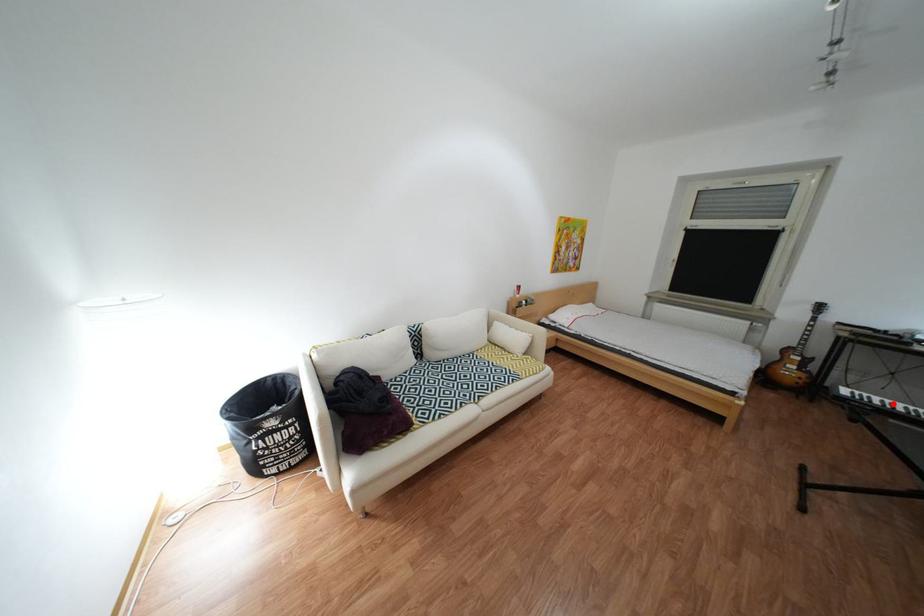
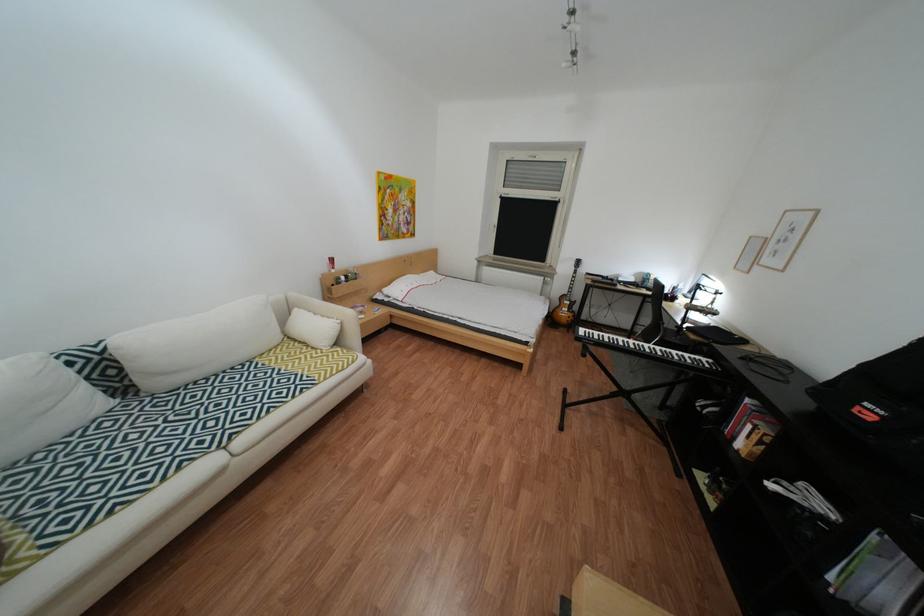
In the second image, find the point that corresponds to the highlighted location in the first image.

(612, 338)